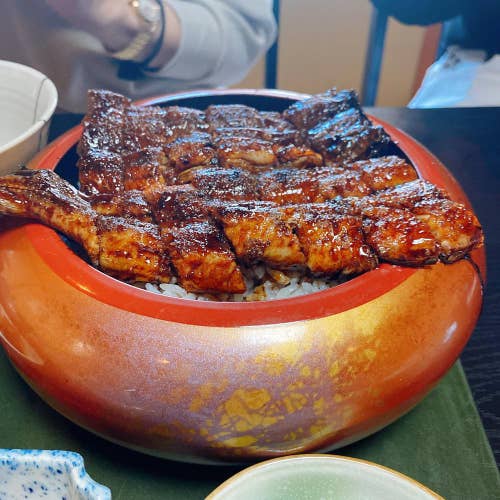
Find the location of a particular element. green bowl is located at coordinates (355, 484).